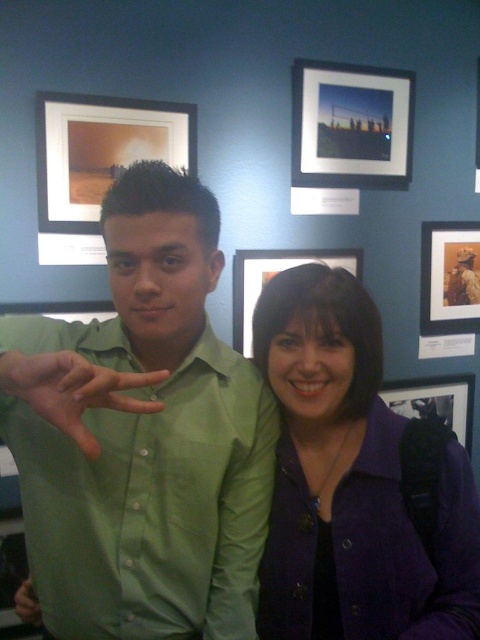
Question: Which object is positioned closest to the matte gold photograph at right?

Choices:
 (A) matte black picture frame at lower right
 (B) matte green shirt at lower left
 (C) matte wooden frame at upper left
 (D) green smooth shirt at center

Answer: (A)

Question: Is matte wooden frame at upper left thinner than green matte shirt at center?

Choices:
 (A) no
 (B) yes

Answer: (A)

Question: Can you confirm if purple fabric jacket at center is positioned below matte plastic picture frame at center?

Choices:
 (A) no
 (B) yes

Answer: (B)

Question: Which object is the farthest from the matte glass picture frame at upper center?

Choices:
 (A) matte wooden frame at upper left
 (B) green smooth shirt at center
 (C) matte black picture frame at lower right
 (D) matte green shirt at lower left

Answer: (D)

Question: Which point is closer to the camera?

Choices:
 (A) green smooth shirt at center
 (B) green matte shirt at center

Answer: (B)

Question: Is matte gold photograph at right to the left of matte green shirt at lower left from the viewer's perspective?

Choices:
 (A) yes
 (B) no

Answer: (B)